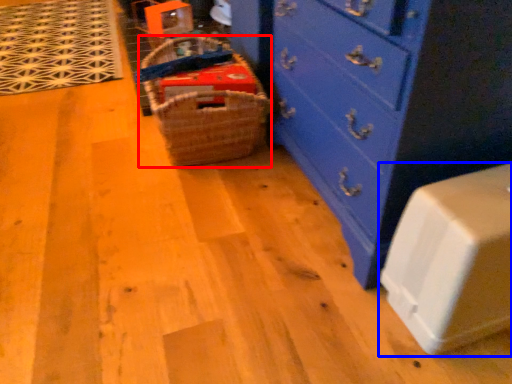
Question: Among these objects, which one is nearest to the camera, basket (highlighted by a red box) or cabinetry (highlighted by a blue box)?

Choices:
 (A) basket
 (B) cabinetry

Answer: (B)